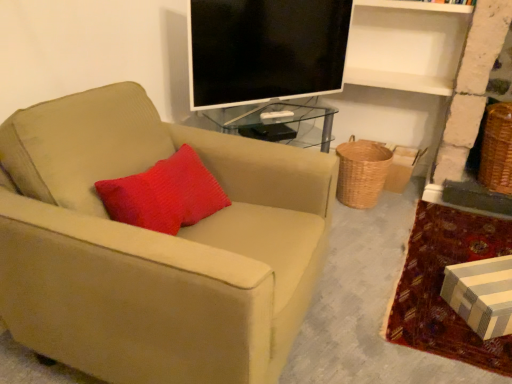
This screenshot has height=384, width=512. Describe the element at coordinates (265, 50) in the screenshot. I see `black glossy tv at upper center` at that location.

In order to face woven brown basket at lower right, placed as the 2th basket when sorted from right to left, should I rotate leftwards or rightwards?

To align with it, rotate right about 13.675°.

Consider the image. How much space does brown woven basket at lower right, positioned as the first basket in right-to-left order, occupy horizontally?

17.26 inches.

What is the approximate width of suede beige armchair at left?

suede beige armchair at left is 96.44 centimeters in width.

This screenshot has height=384, width=512. What do you see at coordinates (155, 246) in the screenshot?
I see `suede beige armchair at left` at bounding box center [155, 246].

Locate an element on the screen. The height and width of the screenshot is (384, 512). striped cardboard box at lower right is located at coordinates (441, 285).

Image resolution: width=512 pixels, height=384 pixels. Identify the location of black glossy tv at upper center. (265, 50).

Is suede beige armchair at left oriented towards woven brown basket at lower right, placed as the 2th basket when sorted from right to left?

No.

Would you consider suede beige armchair at left to be distant from woven brown basket at lower right, placed as the 2th basket when sorted from right to left?

Yes, suede beige armchair at left is far from woven brown basket at lower right, placed as the 2th basket when sorted from right to left.

How different are the orientations of suede beige armchair at left and woven brown basket at lower right, the first basket viewed from the left, in degrees?

The angle between the facing direction of suede beige armchair at left and the facing direction of woven brown basket at lower right, the first basket viewed from the left, is 95.3 degrees.

Measure the distance between suede beige armchair at left and woven brown basket at lower right, placed as the 2th basket when sorted from right to left.

A distance of 1.19 meters exists between suede beige armchair at left and woven brown basket at lower right, placed as the 2th basket when sorted from right to left.

Is the surface of black glossy tv at upper center in direct contact with striped cardboard box at lower right?

No, black glossy tv at upper center is not beside striped cardboard box at lower right.

From a real-world perspective, is black glossy tv at upper center on striped cardboard box at lower right?

Correct, in the physical world, black glossy tv at upper center is higher than striped cardboard box at lower right.

Is black glossy tv at upper center facing away from striped cardboard box at lower right?

No, striped cardboard box at lower right is not at the back of black glossy tv at upper center.

Which of these two, black glossy tv at upper center or striped cardboard box at lower right, is wider?

striped cardboard box at lower right.

Is woven brown basket at lower right, the first basket viewed from the left, at the right side of striped cardboard box at lower right?

No, woven brown basket at lower right, the first basket viewed from the left, is not to the right of striped cardboard box at lower right.

Considering the sizes of objects woven brown basket at lower right, placed as the 2th basket when sorted from right to left, and striped cardboard box at lower right in the image provided, who is wider, woven brown basket at lower right, placed as the 2th basket when sorted from right to left, or striped cardboard box at lower right?

With larger width is woven brown basket at lower right, placed as the 2th basket when sorted from right to left.

Could you tell me if woven brown basket at lower right, the first basket viewed from the left, is turned towards striped cardboard box at lower right?

No, woven brown basket at lower right, the first basket viewed from the left, is not turned towards striped cardboard box at lower right.

Considering the sizes of objects woven brown basket at lower right, the first basket viewed from the left, and striped cardboard box at lower right in the image provided, who is smaller, woven brown basket at lower right, the first basket viewed from the left, or striped cardboard box at lower right?

striped cardboard box at lower right.

In order to click on box behind the striped cardboard box at lower right in this screenshot , I will do `click(481, 295)`.

Is striped cardboard box at lower right facing towards striped cardboard box at lower right?

Yes, striped cardboard box at lower right is aimed at striped cardboard box at lower right.

Is striped cardboard box at lower right not near striped cardboard box at lower right?

Actually, striped cardboard box at lower right and striped cardboard box at lower right are a little close together.

Does brown woven basket at lower right, the second basket viewed from the left, have a greater height compared to striped cardboard box at lower right?

Yes, brown woven basket at lower right, the second basket viewed from the left, is taller than striped cardboard box at lower right.

Between brown woven basket at lower right, positioned as the first basket in right-to-left order, and striped cardboard box at lower right, which one has larger size?

brown woven basket at lower right, positioned as the first basket in right-to-left order, is bigger.

From a real-world perspective, is brown woven basket at lower right, the second basket viewed from the left, on top of striped cardboard box at lower right?

Yes.

Is brown woven basket at lower right, positioned as the first basket in right-to-left order, in front of or behind striped cardboard box at lower right in the image?

Clearly, brown woven basket at lower right, positioned as the first basket in right-to-left order, is behind striped cardboard box at lower right.

Measure the distance from brown woven basket at lower right, the second basket viewed from the left, to black glossy tv at upper center.

brown woven basket at lower right, the second basket viewed from the left, is 1.12 meters from black glossy tv at upper center.

Which is behind, point (503, 193) or point (332, 12)?

The point (503, 193) is farther.

From the image's perspective, is brown woven basket at lower right, the second basket viewed from the left, on top of black glossy tv at upper center?

No, from the image's perspective, brown woven basket at lower right, the second basket viewed from the left, is not on top of black glossy tv at upper center.

Considering the relative positions of brown woven basket at lower right, the second basket viewed from the left, and black glossy tv at upper center in the image provided, is brown woven basket at lower right, the second basket viewed from the left, to the right of black glossy tv at upper center from the viewer's perspective?

Yes.

From a real-world perspective, between black glossy tv at upper center and brown woven basket at lower right, positioned as the first basket in right-to-left order, who is vertically higher?

In real-world perspective, black glossy tv at upper center is above.

Is black glossy tv at upper center inside the boundaries of brown woven basket at lower right, the second basket viewed from the left, or outside?

black glossy tv at upper center cannot be found inside brown woven basket at lower right, the second basket viewed from the left.

From the picture: Which object is closer to the camera taking this photo, black glossy tv at upper center or brown woven basket at lower right, positioned as the first basket in right-to-left order?

Positioned in front is black glossy tv at upper center.

Could you tell me if black glossy tv at upper center is facing brown woven basket at lower right, the second basket viewed from the left?

No, black glossy tv at upper center does not turn towards brown woven basket at lower right, the second basket viewed from the left.

At what (x,y) coordinates should I click in order to perform the action: click on the 1st basket positioned above the suede beige armchair at left (from the image's perspective). Please return your answer as a coordinate pair (x, y). The image size is (512, 384). Looking at the image, I should click on (361, 172).

In the image, there is a black glossy tv at upper center. At what (x,y) coordinates should I click in order to perform the action: click on box below it (from a real-world perspective). Please return your answer as a coordinate pair (x, y). Looking at the image, I should click on (481, 295).

Considering their positions, is brown woven basket at lower right, the second basket viewed from the left, positioned closer to striped cardboard box at lower right than suede beige armchair at left?

brown woven basket at lower right, the second basket viewed from the left.

From the picture: Looking at the image, which one is located closer to woven brown basket at lower right, placed as the 2th basket when sorted from right to left, brown woven basket at lower right, positioned as the first basket in right-to-left order, or suede beige armchair at left?

brown woven basket at lower right, positioned as the first basket in right-to-left order, lies closer to woven brown basket at lower right, placed as the 2th basket when sorted from right to left, than the other object.

Looking at the image, which one is located further to suede beige armchair at left, black glossy tv at upper center or striped cardboard box at lower right?

The object further to suede beige armchair at left is striped cardboard box at lower right.

Looking at the image, which one is located further to suede beige armchair at left, striped cardboard box at lower right or brown woven basket at lower right, the second basket viewed from the left?

brown woven basket at lower right, the second basket viewed from the left, is positioned further to the anchor suede beige armchair at left.

Estimate the real-world distances between objects in this image. Which object is closer to black glossy tv at upper center, suede beige armchair at left or striped cardboard box at lower right?

suede beige armchair at left.

When comparing their distances from striped cardboard box at lower right, does suede beige armchair at left or black glossy tv at upper center seem further?

Among the two, black glossy tv at upper center is located further to striped cardboard box at lower right.

Considering their positions, is woven brown basket at lower right, placed as the 2th basket when sorted from right to left, positioned further to striped cardboard box at lower right than brown woven basket at lower right, positioned as the first basket in right-to-left order?

brown woven basket at lower right, positioned as the first basket in right-to-left order, is positioned further to the anchor striped cardboard box at lower right.

Looking at the image, which one is located closer to brown woven basket at lower right, the second basket viewed from the left, striped cardboard box at lower right or black glossy tv at upper center?

striped cardboard box at lower right lies closer to brown woven basket at lower right, the second basket viewed from the left, than the other object.

The width and height of the screenshot is (512, 384). I want to click on plain that lies between brown woven basket at lower right, positioned as the first basket in right-to-left order, and striped cardboard box at lower right from top to bottom, so point(441,285).

Locate an element on the screen. This screenshot has height=384, width=512. plain between black glossy tv at upper center and brown woven basket at lower right, the second basket viewed from the left is located at coordinates pyautogui.click(x=441, y=285).

Image resolution: width=512 pixels, height=384 pixels. Identify the location of box between striped cardboard box at lower right and woven brown basket at lower right, placed as the 2th basket when sorted from right to left, from front to back. (481, 295).

Identify the location of box between suede beige armchair at left and woven brown basket at lower right, placed as the 2th basket when sorted from right to left, along the z-axis. (481, 295).